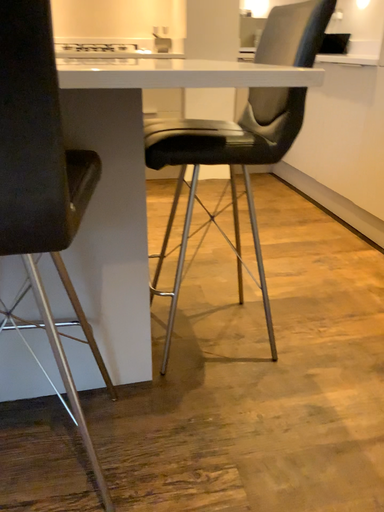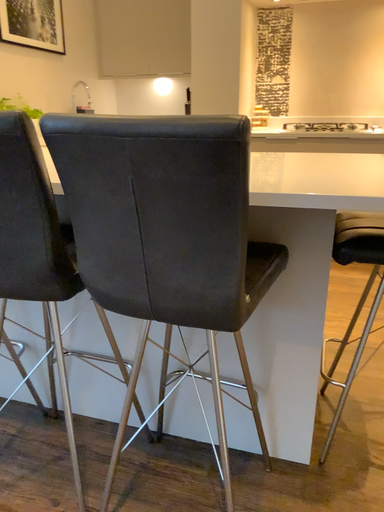
Question: Which way did the camera rotate in the video?

Choices:
 (A) rotated right
 (B) rotated left

Answer: (B)